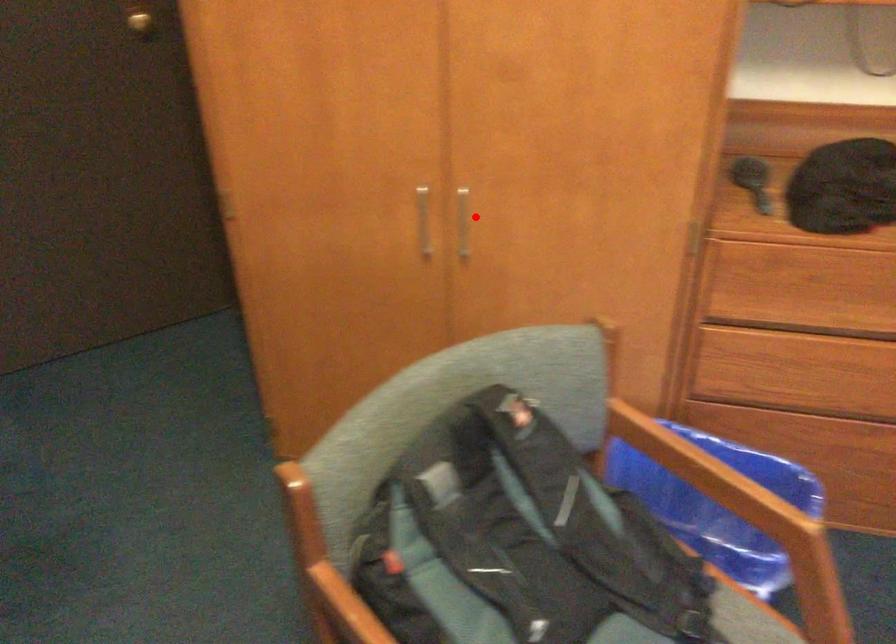
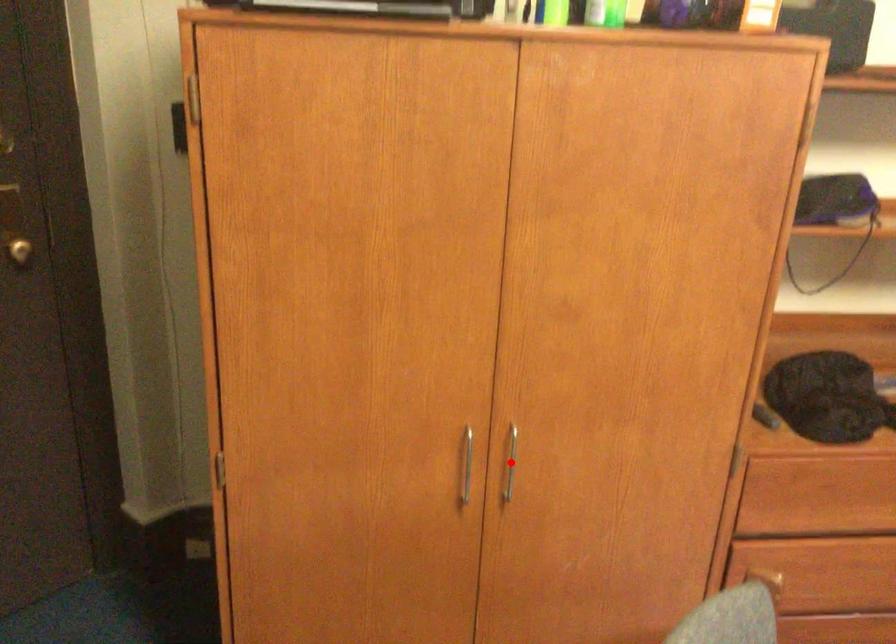
I am providing you with two images of the same scene from different viewpoints. A red point is marked on the first image and another point is marked on the second image. Is the marked point in image1 the same physical position as the marked point in image2?

Yes